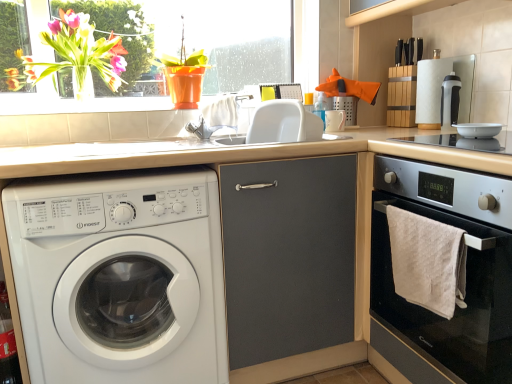
Question: Considering the relative sizes of white plastic sink at center and white glossy bowl at upper right in the image provided, is white plastic sink at center taller than white glossy bowl at upper right?

Choices:
 (A) no
 (B) yes

Answer: (B)

Question: From the image's perspective, does white plastic sink at center appear lower than white glossy bowl at upper right?

Choices:
 (A) yes
 (B) no

Answer: (B)

Question: Is the position of white plastic sink at center more distant than that of white glossy bowl at upper right?

Choices:
 (A) no
 (B) yes

Answer: (B)

Question: Is white plastic sink at center thinner than white glossy bowl at upper right?

Choices:
 (A) yes
 (B) no

Answer: (B)

Question: Is white plastic sink at center not close to white glossy bowl at upper right?

Choices:
 (A) yes
 (B) no

Answer: (B)

Question: Considering the relative sizes of white plastic sink at center and white glossy bowl at upper right in the image provided, is white plastic sink at center wider than white glossy bowl at upper right?

Choices:
 (A) yes
 (B) no

Answer: (A)

Question: Does transparent glass window at upper left lie in front of beige laminate countertop at center?

Choices:
 (A) no
 (B) yes

Answer: (A)

Question: Would you consider transparent glass window at upper left to be distant from beige laminate countertop at center?

Choices:
 (A) yes
 (B) no

Answer: (A)

Question: From a real-world perspective, is transparent glass window at upper left located higher than beige laminate countertop at center?

Choices:
 (A) no
 (B) yes

Answer: (B)

Question: Considering the relative sizes of transparent glass window at upper left and beige laminate countertop at center in the image provided, is transparent glass window at upper left bigger than beige laminate countertop at center?

Choices:
 (A) no
 (B) yes

Answer: (A)

Question: Is transparent glass window at upper left to the right of beige laminate countertop at center from the viewer's perspective?

Choices:
 (A) no
 (B) yes

Answer: (A)

Question: Is transparent glass window at upper left taller than beige laminate countertop at center?

Choices:
 (A) no
 (B) yes

Answer: (A)

Question: Considering the relative positions of transparent glass window at upper left and white plastic washing machine at left in the image provided, is transparent glass window at upper left in front of white plastic washing machine at left?

Choices:
 (A) no
 (B) yes

Answer: (A)